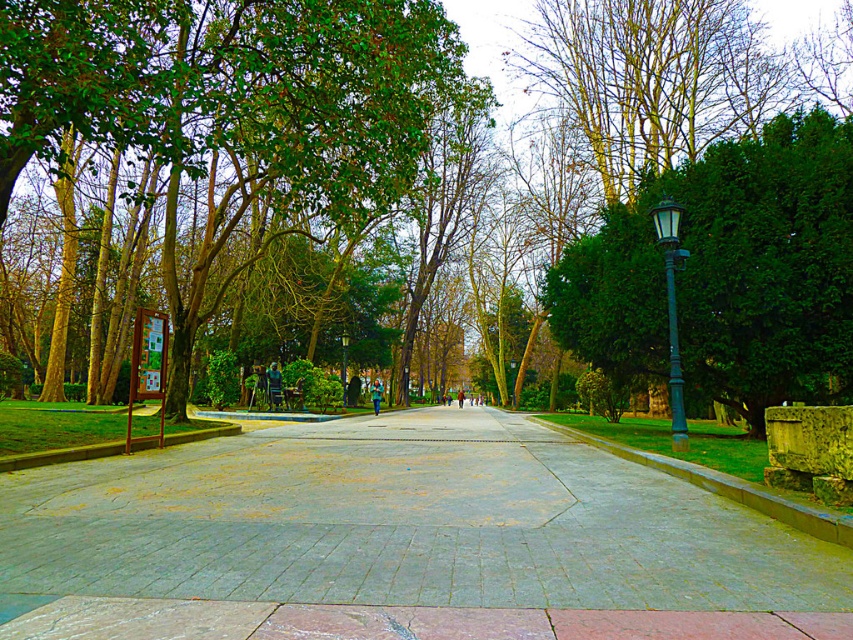
Question: Estimate the real-world distances between objects in this image. Which object is farther from the green leafy tree at left?

Choices:
 (A) gray concrete pavement at center
 (B) green matte lamp post at right

Answer: (B)

Question: Which object appears closest to the camera in this image?

Choices:
 (A) gray concrete pavement at center
 (B) green leafy tree at left
 (C) green stone curb at right

Answer: (A)

Question: Is gray concrete pavement at center thinner than green stone curb at right?

Choices:
 (A) no
 (B) yes

Answer: (A)

Question: Does green leafy tree at left appear over green stone curb at right?

Choices:
 (A) no
 (B) yes

Answer: (B)

Question: Based on their relative distances, which object is nearer to the green stone curb at right?

Choices:
 (A) gray concrete pavement at center
 (B) green leafy tree at right
 (C) green matte lamp post at right
 (D) green leafy tree at left

Answer: (C)

Question: Does gray concrete pavement at center appear on the right side of green leafy tree at left?

Choices:
 (A) yes
 (B) no

Answer: (A)